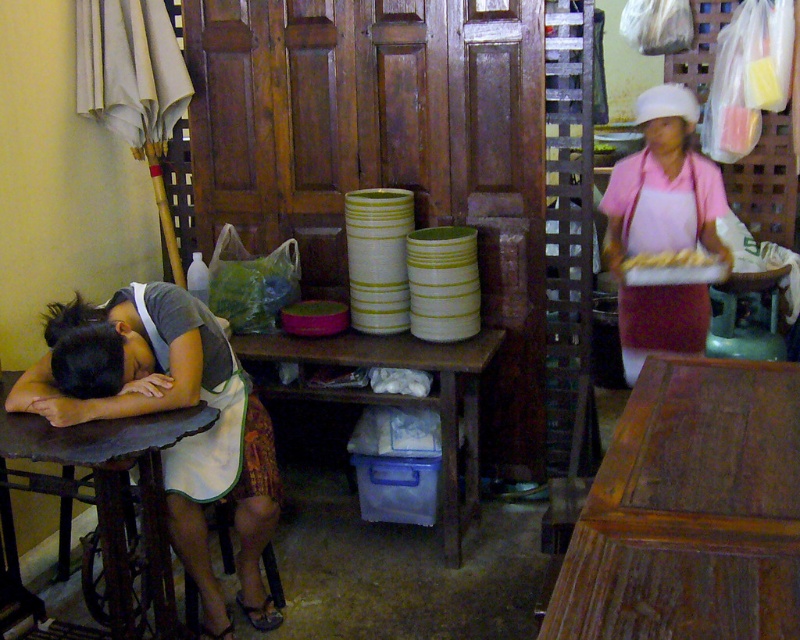
You are trying to decide which table, the wooden table at lower right or the rustic wood table at lower left, can accommodate a large rectangular platter that requires a minimum width of 1.2 meters. Based on the scene description, which table should you choose?

The wooden table at lower right might be wider than rustic wood table at lower left, so you should choose the wooden table at lower right to place the large rectangular platter.

You are standing in the kitchen and want to place a 7.5 feet long board on the rustic wood table at lower left. Can you fit it on the table without moving any other items?

The rustic wood table at lower left is 6.75 feet away from the camera, so the distance between you and the table is 6.75 feet. However, the length of the board you want to place is 7.5 feet, which is longer than the table itself. Therefore, the board cannot fit on the rustic wood table at lower left without moving other items.